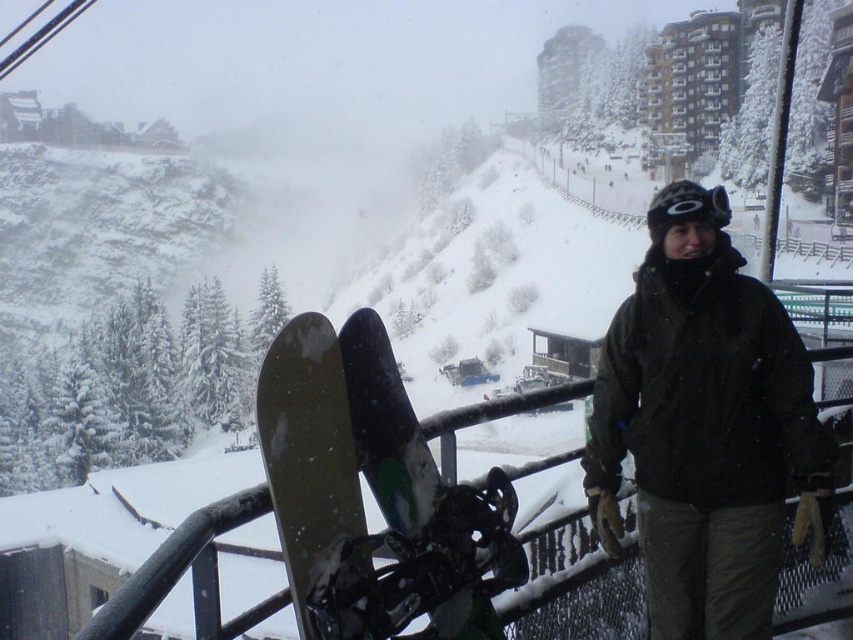
Question: Which of the following is the closest to the observer?

Choices:
 (A) (648, 208)
 (B) (315, 481)

Answer: (B)

Question: Does dark green jacket at center have a lesser width compared to green matte snowboard at center?

Choices:
 (A) yes
 (B) no

Answer: (B)

Question: Which of the following is the farthest from the observer?

Choices:
 (A) (689, 182)
 (B) (312, 576)

Answer: (A)

Question: Can you confirm if matte black snowboard at lower center is positioned to the right of black matte goggles at center?

Choices:
 (A) no
 (B) yes

Answer: (A)

Question: Is matte black snowboard at lower center further to camera compared to green matte snowboard at center?

Choices:
 (A) yes
 (B) no

Answer: (B)

Question: Which is nearer to the black matte goggles at center?

Choices:
 (A) green matte snowboard at center
 (B) matte black snowboard at lower center
 (C) dark green jacket at center

Answer: (C)